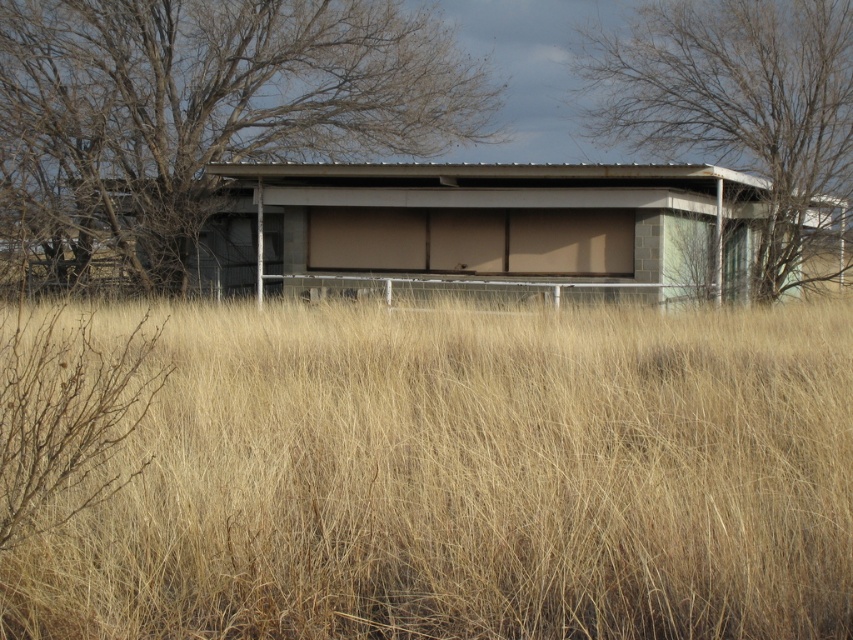
Question: Does dry grass at center appear over bare branches at center?

Choices:
 (A) yes
 (B) no

Answer: (B)

Question: Which object is positioned closest to the gray concrete hut at center?

Choices:
 (A) bare branches at center
 (B) bare branches at upper center

Answer: (A)

Question: Can you confirm if bare branches at center is positioned above gray concrete hut at center?

Choices:
 (A) yes
 (B) no

Answer: (A)

Question: Is the position of gray concrete hut at center more distant than that of bare branches at upper center?

Choices:
 (A) no
 (B) yes

Answer: (A)

Question: Considering the real-world distances, which object is farthest from the gray concrete hut at center?

Choices:
 (A) bare branches at center
 (B) dry grass at center

Answer: (B)

Question: Which point is closer to the camera?

Choices:
 (A) (364, 72)
 (B) (514, 225)
 (C) (323, 486)
 (D) (775, 172)

Answer: (C)